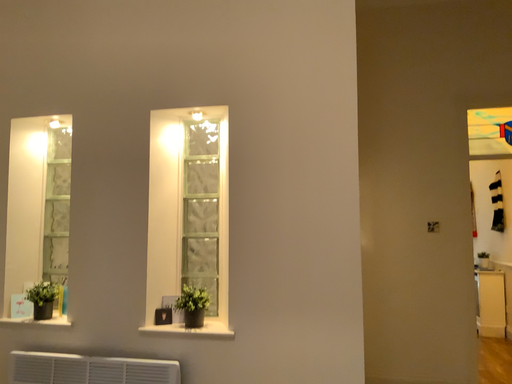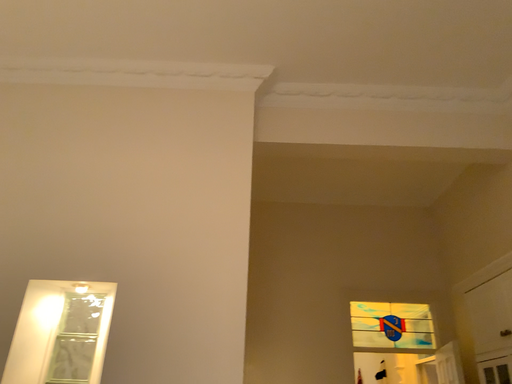
Question: How did the camera likely rotate when shooting the video?

Choices:
 (A) rotated left
 (B) rotated right

Answer: (B)